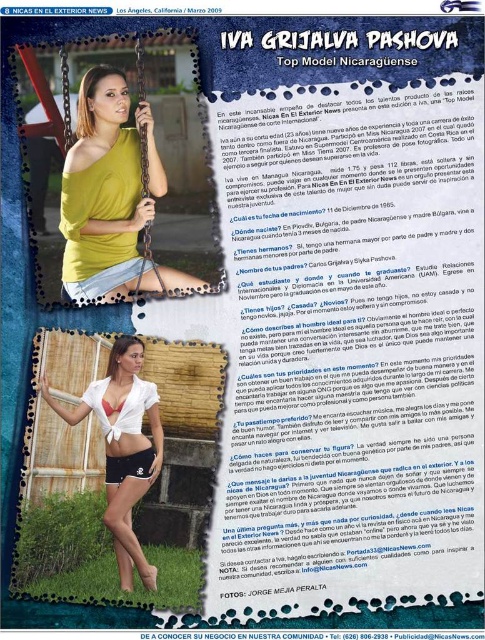
Does matte white bikini top at center have a lesser height compared to black matte shorts at lower center?

No.

Who is more forward, (53, 408) or (119, 474)?

Point (119, 474) is more forward.

What are the coordinates of `matte white bikini top at center` in the screenshot? It's located at (123, 449).

Is mustard yellow jersey at center wider than matte white bikini top at center?

Correct, the width of mustard yellow jersey at center exceeds that of matte white bikini top at center.

Which is in front, point (104, 264) or point (132, 371)?

Point (132, 371) is more forward.

Does point (163, 179) come in front of point (139, 481)?

No.

You are a GUI agent. You are given a task and a screenshot of the screen. Output one action in this format:
    pyautogui.click(x=<x>, y=<y>)
    Task: Click on the mustard yellow jersey at center
    The image size is (485, 640).
    Given the screenshot: What is the action you would take?
    pyautogui.click(x=112, y=196)

Does black matte shorts at lower center have a lesser height compared to white matte bikini top at center?

In fact, black matte shorts at lower center may be taller than white matte bikini top at center.

Is black matte shorts at lower center to the right of white matte bikini top at center from the viewer's perspective?

Indeed, black matte shorts at lower center is positioned on the right side of white matte bikini top at center.

Which is behind, point (139, 468) or point (107, 404)?

The point (107, 404) is behind.

What are the coordinates of `black matte shorts at lower center` in the screenshot? It's located at (129, 465).